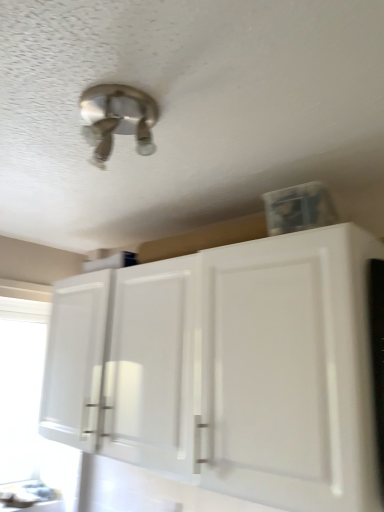
At what (x,y) coordinates should I click in order to perform the action: click on transparent plastic window screen at left. Please return your answer as a coordinate pair (x, y). Looking at the image, I should click on (20, 396).

This screenshot has height=512, width=384. I want to click on white glossy cabinet at lower right, so click(227, 369).

You are a GUI agent. You are given a task and a screenshot of the screen. Output one action in this format:
    pyautogui.click(x=<x>, y=<y>)
    Task: Click on the transparent plastic window screen at left
    Image resolution: width=384 pixels, height=512 pixels.
    Given the screenshot: What is the action you would take?
    pyautogui.click(x=20, y=396)

Which is behind, point (15, 359) or point (123, 103)?

The point (15, 359) is behind.

Is transparent plastic window screen at left shorter than satin nickel light fixture at upper center?

No, transparent plastic window screen at left is not shorter than satin nickel light fixture at upper center.

Which of these two, transparent plastic window screen at left or satin nickel light fixture at upper center, is smaller?

satin nickel light fixture at upper center.

From the image's perspective, who appears lower, transparent plastic window screen at left or satin nickel light fixture at upper center?

transparent plastic window screen at left appears lower in the image.

Does transparent plastic window screen at left lie in front of white glossy cabinet at lower right?

No, it is not.

From a real-world perspective, is transparent plastic window screen at left physically located above or below white glossy cabinet at lower right?

From a real-world perspective, transparent plastic window screen at left is physically below white glossy cabinet at lower right.

Is white glossy cabinet at lower right at the back of transparent plastic window screen at left?

transparent plastic window screen at left does not have its back to white glossy cabinet at lower right.

Considering the positions of point (9, 442) and point (147, 347), is point (9, 442) closer or farther from the camera than point (147, 347)?

Point (9, 442) is positioned farther from the camera compared to point (147, 347).

Which is in front, point (117, 371) or point (83, 103)?

Point (83, 103)

Considering the sizes of white glossy cabinet at lower right and satin nickel light fixture at upper center in the image, is white glossy cabinet at lower right taller or shorter than satin nickel light fixture at upper center?

Clearly, white glossy cabinet at lower right is taller compared to satin nickel light fixture at upper center.

Does white glossy cabinet at lower right have a lesser width compared to satin nickel light fixture at upper center?

No, white glossy cabinet at lower right is not thinner than satin nickel light fixture at upper center.

There is a white glossy cabinet at lower right. Where is `light fixture above it (from a real-world perspective)`? The width and height of the screenshot is (384, 512). light fixture above it (from a real-world perspective) is located at coordinates (117, 119).

Could you tell me if satin nickel light fixture at upper center is turned towards white glossy cabinet at lower right?

No.

Between satin nickel light fixture at upper center and white glossy cabinet at lower right, which one has more height?

With more height is white glossy cabinet at lower right.

Between satin nickel light fixture at upper center and white glossy cabinet at lower right, which one has larger size?

white glossy cabinet at lower right.

Consider the image. Considering the sizes of white glossy cabinet at lower right and transparent plastic window screen at left in the image, is white glossy cabinet at lower right taller or shorter than transparent plastic window screen at left?

In the image, white glossy cabinet at lower right appears to be shorter than transparent plastic window screen at left.

The height and width of the screenshot is (512, 384). What are the coordinates of `window screen behind the white glossy cabinet at lower right` in the screenshot? It's located at (20, 396).

Would you say white glossy cabinet at lower right is a long distance from transparent plastic window screen at left?

Yes.

From the image's perspective, relative to transparent plastic window screen at left, is satin nickel light fixture at upper center above or below?

Clearly, from the image's perspective, satin nickel light fixture at upper center is above transparent plastic window screen at left.

Are satin nickel light fixture at upper center and transparent plastic window screen at left far apart?

Yes, satin nickel light fixture at upper center and transparent plastic window screen at left are located far from each other.

Is transparent plastic window screen at left at the back of satin nickel light fixture at upper center?

No, transparent plastic window screen at left is not at the back of satin nickel light fixture at upper center.

Which object is further away from the camera taking this photo, satin nickel light fixture at upper center or transparent plastic window screen at left?

transparent plastic window screen at left is more distant.

At what (x,y) coordinates should I click in order to perform the action: click on window screen on the left of satin nickel light fixture at upper center. Please return your answer as a coordinate pair (x, y). Looking at the image, I should click on [x=20, y=396].

This screenshot has width=384, height=512. What are the coordinates of `cabinetry that appears above the transparent plastic window screen at left (from a real-world perspective)` in the screenshot? It's located at (227, 369).

Which object lies nearer to the anchor point white glossy cabinet at lower right, transparent plastic window screen at left or satin nickel light fixture at upper center?

Among the two, satin nickel light fixture at upper center is located nearer to white glossy cabinet at lower right.

When comparing their distances from white glossy cabinet at lower right, does satin nickel light fixture at upper center or transparent plastic window screen at left seem closer?

satin nickel light fixture at upper center lies closer to white glossy cabinet at lower right than the other object.

From the image, which object appears to be farther from satin nickel light fixture at upper center, white glossy cabinet at lower right or transparent plastic window screen at left?

transparent plastic window screen at left is further to satin nickel light fixture at upper center.

Estimate the real-world distances between objects in this image. Which object is closer to transparent plastic window screen at left, white glossy cabinet at lower right or satin nickel light fixture at upper center?

white glossy cabinet at lower right lies closer to transparent plastic window screen at left than the other object.

Which object lies further to the anchor point satin nickel light fixture at upper center, transparent plastic window screen at left or white glossy cabinet at lower right?

Among the two, transparent plastic window screen at left is located further to satin nickel light fixture at upper center.

When comparing their distances from transparent plastic window screen at left, does satin nickel light fixture at upper center or white glossy cabinet at lower right seem further?

Among the two, satin nickel light fixture at upper center is located further to transparent plastic window screen at left.

Identify the location of cabinetry between satin nickel light fixture at upper center and transparent plastic window screen at left from front to back. This screenshot has width=384, height=512. (227, 369).